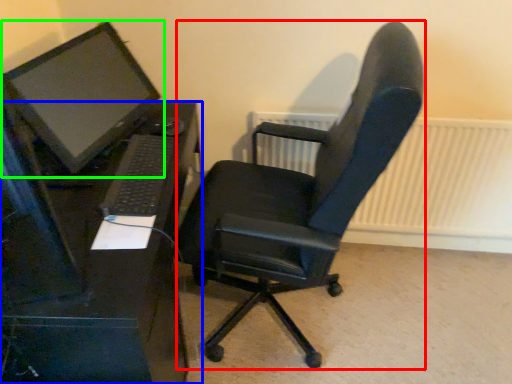
Question: Which is nearer to the computer chair (highlighted by a red box)? desk (highlighted by a blue box) or computer monitor (highlighted by a green box).

Choices:
 (A) desk
 (B) computer monitor

Answer: (A)